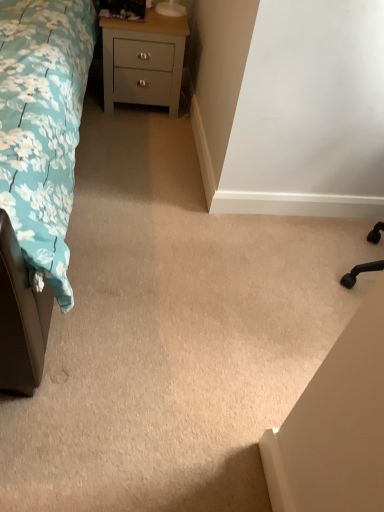
Locate an element on the screen. The width and height of the screenshot is (384, 512). teal floral fabric bed at left is located at coordinates (43, 125).

What is the approximate height of teal floral fabric bed at left?

teal floral fabric bed at left is 3.29 feet in height.

Describe the element at coordinates (43, 125) in the screenshot. I see `teal floral fabric bed at left` at that location.

What do you see at coordinates (143, 61) in the screenshot? I see `light gray painted wood chest of drawers at upper left` at bounding box center [143, 61].

Where is `light gray painted wood chest of drawers at upper left`? light gray painted wood chest of drawers at upper left is located at coordinates (143, 61).

This screenshot has width=384, height=512. What are the coordinates of `teal floral fabric bed at left` in the screenshot? It's located at (43, 125).

Can you confirm if teal floral fabric bed at left is positioned to the left of light gray painted wood chest of drawers at upper left?

Indeed, teal floral fabric bed at left is positioned on the left side of light gray painted wood chest of drawers at upper left.

In the image, is teal floral fabric bed at left positioned in front of or behind light gray painted wood chest of drawers at upper left?

In the image, teal floral fabric bed at left appears in front of light gray painted wood chest of drawers at upper left.

Is point (70, 52) closer to viewer compared to point (160, 69)?

Yes, it is.

From the image's perspective, between teal floral fabric bed at left and light gray painted wood chest of drawers at upper left, which one is located above?

light gray painted wood chest of drawers at upper left is shown above in the image.

From a real-world perspective, is teal floral fabric bed at left located higher than light gray painted wood chest of drawers at upper left?

Yes, from a real-world perspective, teal floral fabric bed at left is above light gray painted wood chest of drawers at upper left.

Does teal floral fabric bed at left have a lesser width compared to light gray painted wood chest of drawers at upper left?

Incorrect, the width of teal floral fabric bed at left is not less than that of light gray painted wood chest of drawers at upper left.

Considering the relative sizes of teal floral fabric bed at left and light gray painted wood chest of drawers at upper left in the image provided, is teal floral fabric bed at left taller than light gray painted wood chest of drawers at upper left?

Indeed, teal floral fabric bed at left has a greater height compared to light gray painted wood chest of drawers at upper left.

In terms of size, does teal floral fabric bed at left appear bigger or smaller than light gray painted wood chest of drawers at upper left?

Considering their sizes, teal floral fabric bed at left takes up more space than light gray painted wood chest of drawers at upper left.

Is teal floral fabric bed at left spatially inside light gray painted wood chest of drawers at upper left, or outside of it?

teal floral fabric bed at left exists outside the volume of light gray painted wood chest of drawers at upper left.

Are teal floral fabric bed at left and light gray painted wood chest of drawers at upper left far apart?

teal floral fabric bed at left is near light gray painted wood chest of drawers at upper left, not far away.

Is teal floral fabric bed at left facing away from light gray painted wood chest of drawers at upper left?

No, light gray painted wood chest of drawers at upper left is not at the back of teal floral fabric bed at left.

How many degrees apart are the facing directions of teal floral fabric bed at left and light gray painted wood chest of drawers at upper left?

0.907 degrees separate the facing orientations of teal floral fabric bed at left and light gray painted wood chest of drawers at upper left.

You are a GUI agent. You are given a task and a screenshot of the screen. Output one action in this format:
    pyautogui.click(x=<x>, y=<y>)
    Task: Click on the bed below the light gray painted wood chest of drawers at upper left (from the image's perspective)
    This screenshot has width=384, height=512.
    Given the screenshot: What is the action you would take?
    pyautogui.click(x=43, y=125)

Considering the relative positions of light gray painted wood chest of drawers at upper left and teal floral fabric bed at left in the image provided, is light gray painted wood chest of drawers at upper left to the left or to the right of teal floral fabric bed at left?

Based on their positions, light gray painted wood chest of drawers at upper left is located to the right of teal floral fabric bed at left.

In the image, is light gray painted wood chest of drawers at upper left positioned in front of or behind teal floral fabric bed at left?

Visually, light gray painted wood chest of drawers at upper left is located behind teal floral fabric bed at left.

Which is in front, point (152, 30) or point (48, 204)?

Point (48, 204)

From the image's perspective, between light gray painted wood chest of drawers at upper left and teal floral fabric bed at left, which one is located above?

From the image's view, light gray painted wood chest of drawers at upper left is above.

Consider the image. From a real-world perspective, is light gray painted wood chest of drawers at upper left positioned above or below teal floral fabric bed at left?

light gray painted wood chest of drawers at upper left is below teal floral fabric bed at left.

Which object is thinner, light gray painted wood chest of drawers at upper left or teal floral fabric bed at left?

light gray painted wood chest of drawers at upper left.

Considering the relative sizes of light gray painted wood chest of drawers at upper left and teal floral fabric bed at left in the image provided, is light gray painted wood chest of drawers at upper left shorter than teal floral fabric bed at left?

Correct, light gray painted wood chest of drawers at upper left is not as tall as teal floral fabric bed at left.

Based on their sizes in the image, would you say light gray painted wood chest of drawers at upper left is bigger or smaller than teal floral fabric bed at left?

Clearly, light gray painted wood chest of drawers at upper left is smaller in size than teal floral fabric bed at left.

Is light gray painted wood chest of drawers at upper left positioned beyond the bounds of teal floral fabric bed at left?

That's correct, light gray painted wood chest of drawers at upper left is outside of teal floral fabric bed at left.

Is light gray painted wood chest of drawers at upper left not near teal floral fabric bed at left?

That's not correct — light gray painted wood chest of drawers at upper left is a little close to teal floral fabric bed at left.

Is light gray painted wood chest of drawers at upper left looking in the opposite direction of teal floral fabric bed at left?

light gray painted wood chest of drawers at upper left does not have its back to teal floral fabric bed at left.

Can you tell me how much light gray painted wood chest of drawers at upper left and teal floral fabric bed at left differ in facing direction?

0.907 degrees separate the facing orientations of light gray painted wood chest of drawers at upper left and teal floral fabric bed at left.

How much distance is there between light gray painted wood chest of drawers at upper left and teal floral fabric bed at left?

They are 20.12 inches apart.

Identify the location of chest of drawers above the teal floral fabric bed at left (from the image's perspective). This screenshot has height=512, width=384. [143, 61].

The height and width of the screenshot is (512, 384). I want to click on the chest of drawers that appears behind the teal floral fabric bed at left, so click(143, 61).

Where is `the chest of drawers located underneath the teal floral fabric bed at left (from a real-world perspective)`? This screenshot has height=512, width=384. the chest of drawers located underneath the teal floral fabric bed at left (from a real-world perspective) is located at coordinates (143, 61).